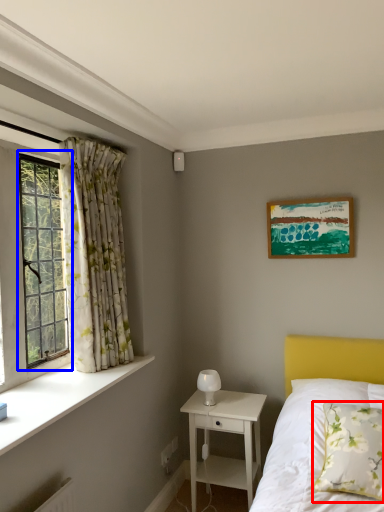
Question: Which of the following is the farthest to the observer, pillow (highlighted by a red box) or window (highlighted by a blue box)?

Choices:
 (A) pillow
 (B) window

Answer: (B)